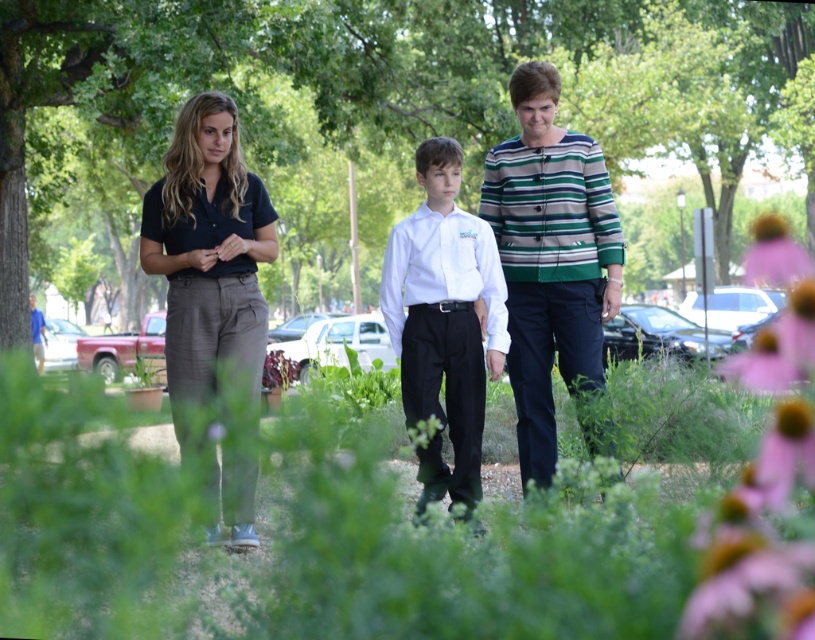
Who is more forward, [570,253] or [540,364]?

Point [570,253] is more forward.

Is point (447, 401) behind point (610, 284)?

Yes.

Where is `matte black pants at center`? matte black pants at center is located at coordinates (501, 288).

Is point (767, 380) farther from camera compared to point (40, 355)?

No, it is in front of (40, 355).

Identify the location of pink soft flower at lower right. This screenshot has height=640, width=815. (774, 356).

Where is `pink soft flower at lower right`? pink soft flower at lower right is located at coordinates (774, 356).

Is pink fuzzy flower at right smaller than pink soft flower at lower right?

Actually, pink fuzzy flower at right might be larger than pink soft flower at lower right.

Does pink fuzzy flower at right appear under pink soft flower at lower right?

No, pink fuzzy flower at right is not below pink soft flower at lower right.

Which is behind, point (774, 604) or point (767, 356)?

Point (767, 356)

You are a GUI agent. You are given a task and a screenshot of the screen. Output one action in this format:
    pyautogui.click(x=<x>, y=<y>)
    Task: Click on the pink fuzzy flower at right
    
    Given the screenshot: What is the action you would take?
    pyautogui.click(x=758, y=544)